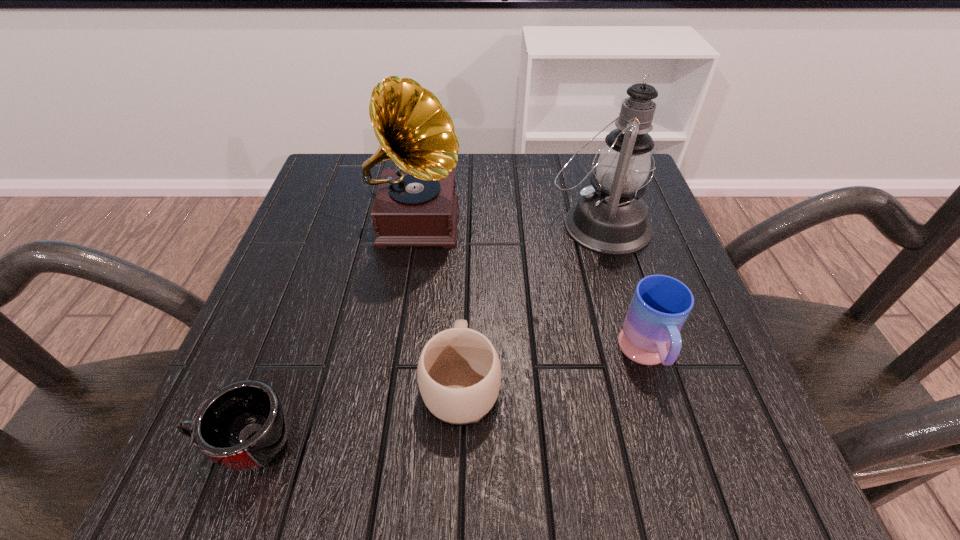
This screenshot has height=540, width=960. What are the coordinates of `free space between the oil lamp and the second mug from left to right` in the screenshot? It's located at (530, 303).

Locate an element on the screen. The height and width of the screenshot is (540, 960). free space between the leftmost object and the second mug from left to right is located at coordinates (353, 413).

Where is `blank region between the phonograph record and the leftmost object`? This screenshot has height=540, width=960. blank region between the phonograph record and the leftmost object is located at coordinates (331, 333).

The height and width of the screenshot is (540, 960). In order to click on free space between the oil lamp and the leftmost object in this screenshot , I will do `click(422, 334)`.

At what (x,y) coordinates should I click in order to perform the action: click on vacant region between the phonograph record and the leftmost object. Please return your answer as a coordinate pair (x, y). Looking at the image, I should click on (331, 333).

Find the location of a particular element. This screenshot has width=960, height=540. vacant area that lies between the second mug from left to right and the third shortest object is located at coordinates (554, 369).

Where is `blank region between the oil lamp and the phonograph record`? blank region between the oil lamp and the phonograph record is located at coordinates (508, 223).

This screenshot has width=960, height=540. In order to click on object that is the fourth closest to the phonograph record in this screenshot , I will do `click(660, 306)`.

Identify the location of object that ranks as the fourth closest to the third tallest object. The height and width of the screenshot is (540, 960). (243, 426).

Choose which mug is the second nearest neighbor to the second mug from left to right. Please provide its 2D coordinates. Your answer should be formatted as a tuple, i.e. [(x, y)], where the tuple contains the x and y coordinates of a point satisfying the conditions above.

[(660, 306)]